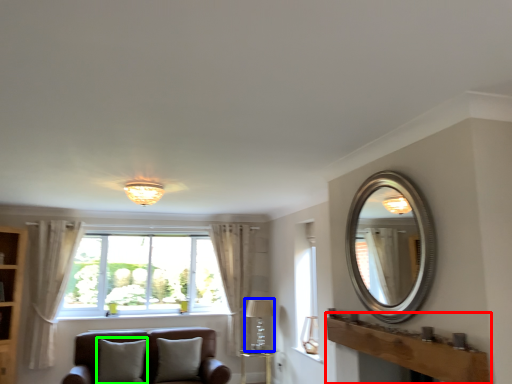
Question: Estimate the real-world distances between objects in this image. Which object is closer to mantle (highlighted by a red box), lamp (highlighted by a blue box) or pillow (highlighted by a green box)?

Choices:
 (A) lamp
 (B) pillow

Answer: (B)